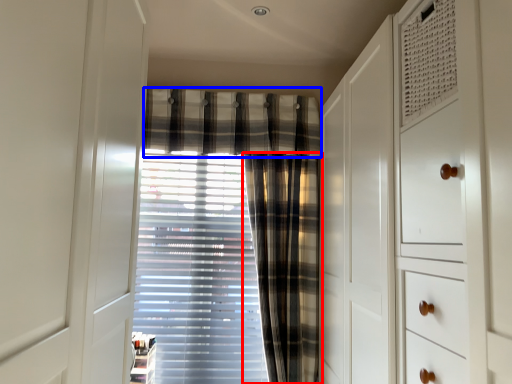
Question: Which object is further to the camera taking this photo, curtain (highlighted by a red box) or plaid (highlighted by a blue box)?

Choices:
 (A) curtain
 (B) plaid

Answer: (B)